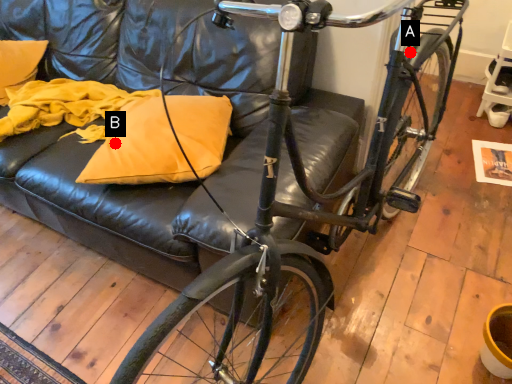
Question: Two points are circled on the image, labeled by A and B beside each circle. Which point is farther to the camera?

Choices:
 (A) A is further
 (B) B is further

Answer: (B)